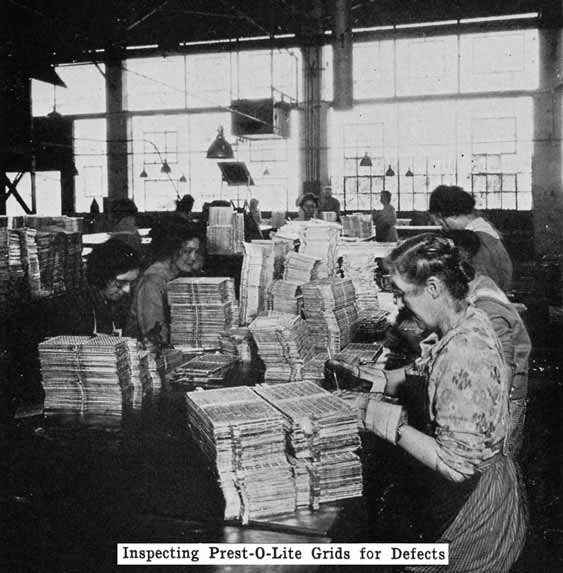
This screenshot has width=563, height=573. I want to click on window, so click(439, 119).